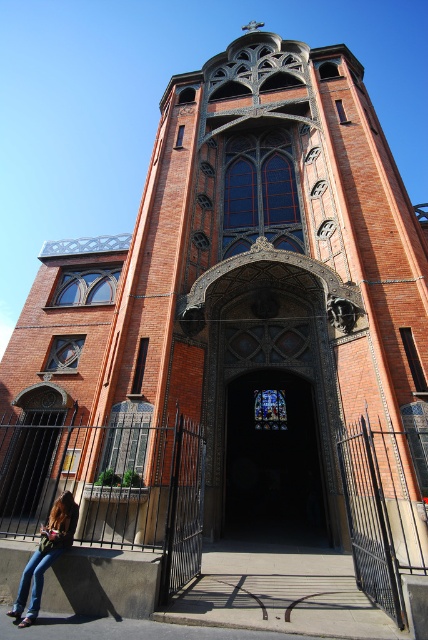
You are a visitor standing in front of the church. You notice the dark stained glass door at center and the denim jeans at lower left. Which object is taller?

The dark stained glass door at center is much taller than the denim jeans at lower left.

You are standing at the entrance of the church and see the dark stained glass door at center and the denim jeans at lower left. From your perspective, which object is positioned to the right?

The dark stained glass door at center is positioned to the right of the denim jeans at lower left.

From the picture: You are standing in front of the church and want to enter through the dark stained glass door at center. To do so, you need to step onto the smooth concrete ledge at lower left. Is the door accessible from the ledge?

The dark stained glass door at center is below the smooth concrete ledge at lower left, so you can step down from the ledge to reach the door.